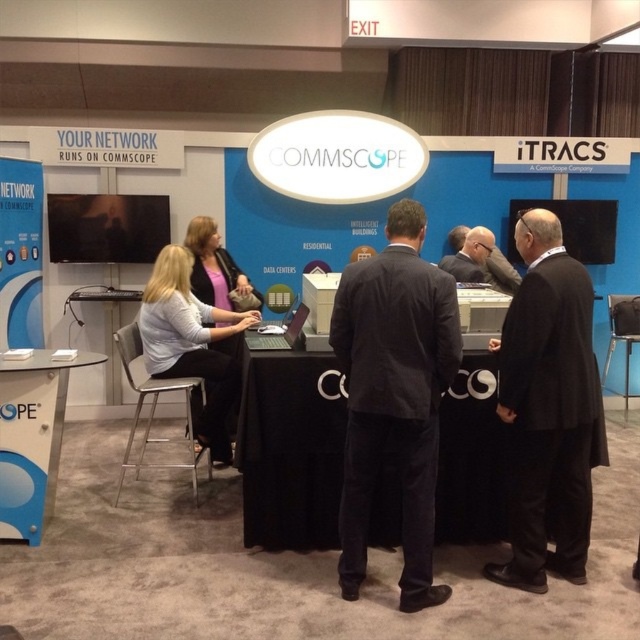
Question: Does dark gray suit at center have a greater width compared to blue plastic table at lower left?

Choices:
 (A) no
 (B) yes

Answer: (B)

Question: Which object appears farthest from the camera in this image?

Choices:
 (A) black fabric table at center
 (B) blue plastic table at lower left

Answer: (A)

Question: Is blue plastic table at lower left bigger than silver metallic laptop at center?

Choices:
 (A) no
 (B) yes

Answer: (B)

Question: Which object is farther from the camera taking this photo?

Choices:
 (A) matte black laptop at center
 (B) black wool coat at center
 (C) blue plastic table at lower left

Answer: (A)

Question: Which of the following is the closest to the observer?

Choices:
 (A) (141, 326)
 (B) (481, 496)
 (C) (285, 333)
 (D) (285, 316)

Answer: (B)

Question: Is the position of black fabric table at center more distant than that of silver metallic laptop at center?

Choices:
 (A) yes
 (B) no

Answer: (B)